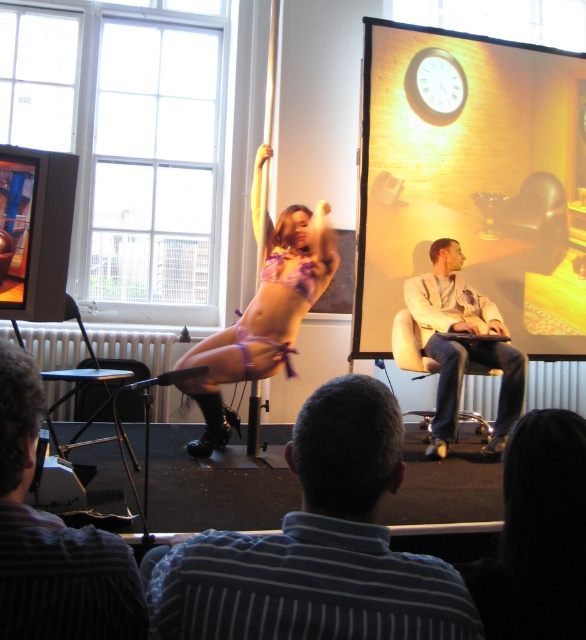
You are a photographer standing at point (316, 547). You want to take a picture of the striped shirt at center. Is the striped shirt at center visible from your current position?

The striped shirt at center is located at point (316, 547), so yes, the photographer can see the striped shirt at center from their current position.

You are an observer in the studio watching the pole dance performance. You need to locate the striped shirt at lower left. Where exactly is it positioned in the scene?

The striped shirt at lower left is positioned at point 0.844 on the x axis and 0.092 on the y axis.